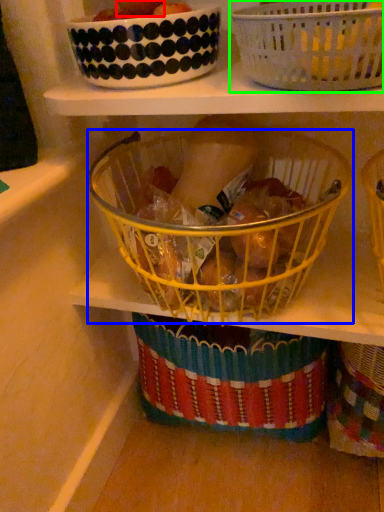
Question: Estimate the real-world distances between objects in this image. Which object is farther from fruit (highlighted by a red box), basket (highlighted by a blue box) or basket (highlighted by a green box)?

Choices:
 (A) basket
 (B) basket

Answer: (A)